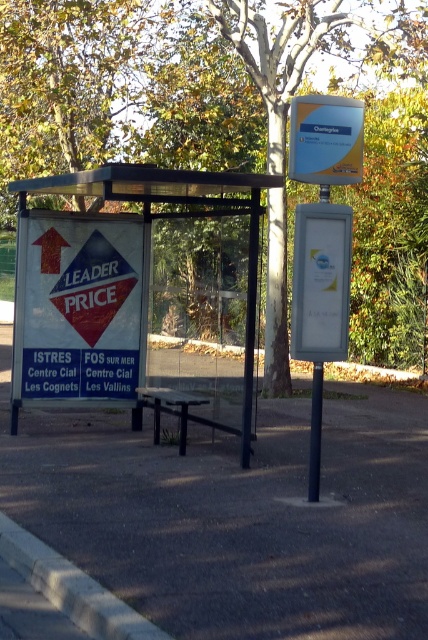
Question: Which object is the farthest from the gray asphalt pavement at center?

Choices:
 (A) green leafy tree at upper center
 (B) white paper sign at left

Answer: (A)

Question: Can you confirm if white paper sign at left is positioned above black plastic pole at center?

Choices:
 (A) no
 (B) yes

Answer: (B)

Question: Which object is farther from the camera taking this photo?

Choices:
 (A) gray concrete curb at lower left
 (B) green leafy tree at upper center
 (C) black plastic pole at center
 (D) white plastic sign at center

Answer: (B)

Question: Considering the relative positions of gray asphalt pavement at center and green leafy tree at upper center in the image provided, where is gray asphalt pavement at center located with respect to green leafy tree at upper center?

Choices:
 (A) left
 (B) right

Answer: (B)

Question: Which point is closer to the camera taking this photo?

Choices:
 (A) (70, 509)
 (B) (315, 440)

Answer: (A)

Question: Can you confirm if gray asphalt pavement at center is wider than gray concrete curb at lower left?

Choices:
 (A) yes
 (B) no

Answer: (B)